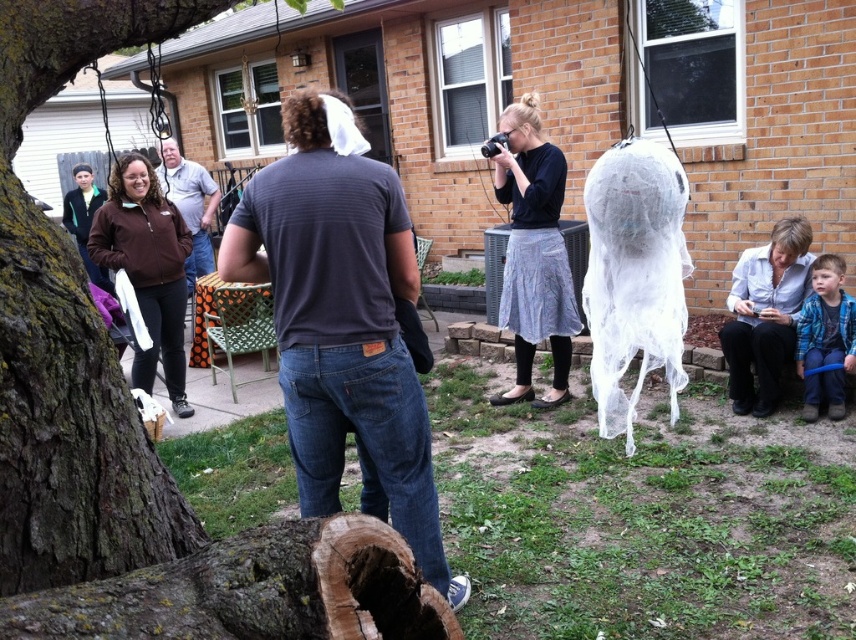
Question: Which point is farther from the camera taking this photo?

Choices:
 (A) (351, 604)
 (B) (807, 221)

Answer: (B)

Question: Is smooth bark tree trunk at lower left above blue plaid shirt at lower right?

Choices:
 (A) yes
 (B) no

Answer: (A)

Question: Is smooth bark tree trunk at lower left thinner than dark gray t-shirt at center?

Choices:
 (A) yes
 (B) no

Answer: (B)

Question: Among these objects, which one is nearest to the camera?

Choices:
 (A) brown fabric shirt at center
 (B) dark gray t-shirt at center
 (C) white lace dress at lower right

Answer: (B)

Question: Considering the real-world distances, which object is closest to the brown fabric shirt at center?

Choices:
 (A) blue plaid shirt at lower right
 (B) white lace dress at lower right
 (C) dark gray t-shirt at center
 (D) smooth bark tree trunk at lower left

Answer: (B)

Question: Considering the relative positions of blue plaid shirt at lower right and brown fabric shirt at center in the image provided, where is blue plaid shirt at lower right located with respect to brown fabric shirt at center?

Choices:
 (A) left
 (B) right

Answer: (B)